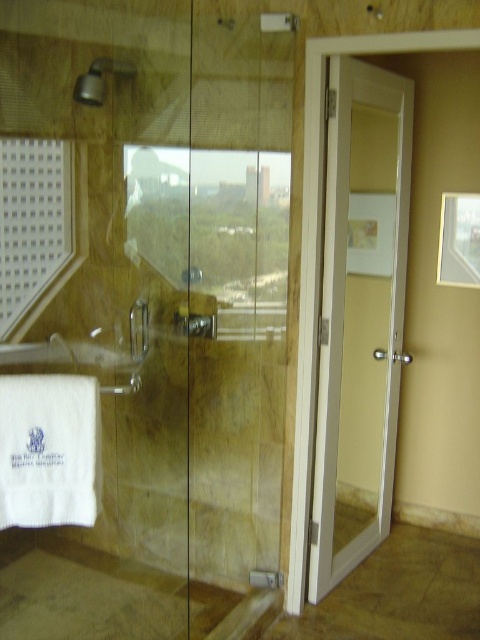
Question: Which of the following is the farthest from the observer?

Choices:
 (A) white glossy door at right
 (B) matte silver showerhead at upper left

Answer: (B)

Question: Is white glossy door at right to the left of matte silver showerhead at upper left from the viewer's perspective?

Choices:
 (A) yes
 (B) no

Answer: (B)

Question: Can you confirm if white glossy door at right is positioned above matte silver showerhead at upper left?

Choices:
 (A) no
 (B) yes

Answer: (A)

Question: Does white glossy door at right have a smaller size compared to matte silver showerhead at upper left?

Choices:
 (A) yes
 (B) no

Answer: (B)

Question: Which point is closer to the camera taking this photo?

Choices:
 (A) (397, 362)
 (B) (104, 99)

Answer: (B)

Question: Which point is closer to the camera?

Choices:
 (A) matte silver showerhead at upper left
 (B) white glossy door at right

Answer: (B)